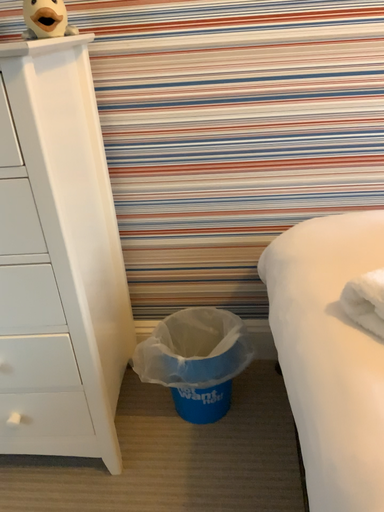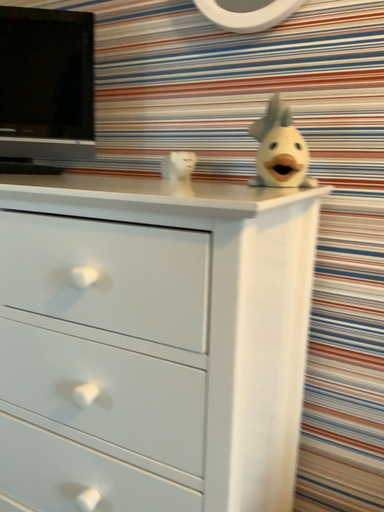
Question: How did the camera likely rotate when shooting the video?

Choices:
 (A) rotated upward
 (B) rotated downward

Answer: (A)